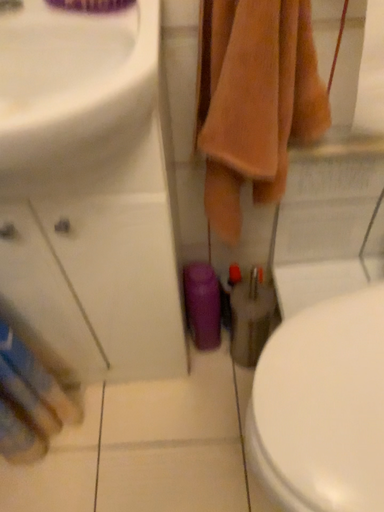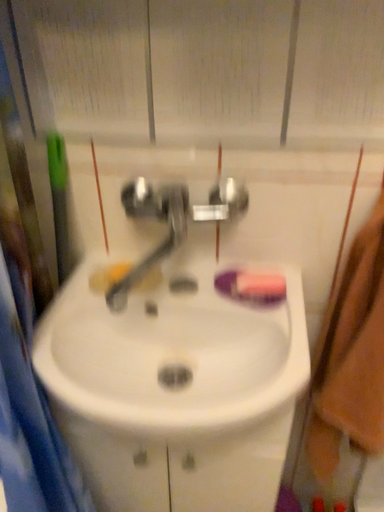
Question: Which way did the camera rotate in the video?

Choices:
 (A) rotated downward
 (B) rotated upward

Answer: (B)